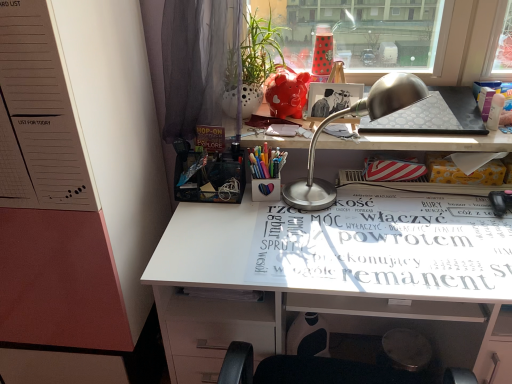
Question: Visually, is silver metallic desk lamp at upper center positioned to the left or to the right of white dotted pot at upper center?

Choices:
 (A) right
 (B) left

Answer: (A)

Question: In terms of height, does silver metallic desk lamp at upper center look taller or shorter compared to white dotted pot at upper center?

Choices:
 (A) tall
 (B) short

Answer: (A)

Question: Which object is positioned farthest from the multicolored plastic pen set at center, which ranks as the first stationery in left-to-right order?

Choices:
 (A) translucent plastic bottle at upper right, acting as the 2th stationery starting from the left
 (B) white glossy desk at center
 (C) white dotted pot at upper center
 (D) silver metallic desk lamp at upper center
 (E) white glossy dresser at left

Answer: (A)

Question: Which object is positioned closest to the multicolored plastic pen set at center, the 2th stationery positioned from the top?

Choices:
 (A) white glossy dresser at left
 (B) white dotted pot at upper center
 (C) silver metallic desk lamp at upper center
 (D) white glossy desk at center
 (E) translucent plastic bottle at upper right, marked as the 1th stationery in a top-to-bottom arrangement

Answer: (C)